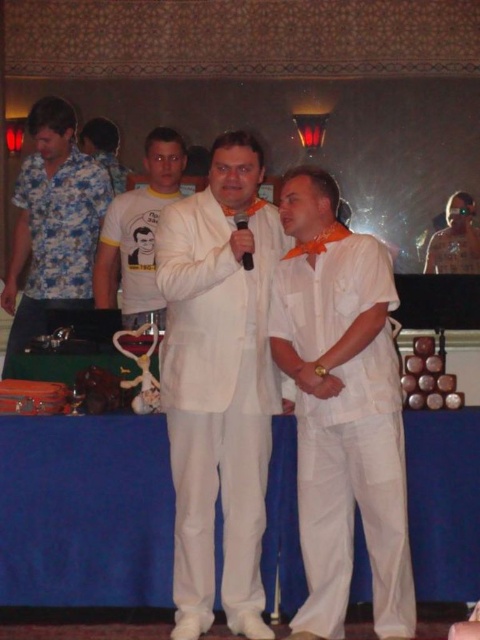
Question: Among these points, which one is nearest to the camera?

Choices:
 (A) (104, 305)
 (B) (233, 218)
 (C) (26, 240)

Answer: (B)

Question: Does white satin shirt at center have a lesser width compared to white cotton t-shirt at center?

Choices:
 (A) yes
 (B) no

Answer: (A)

Question: Can you confirm if white satin shirt at center is positioned above white cotton t-shirt at center?

Choices:
 (A) yes
 (B) no

Answer: (B)

Question: Which point is farther from the camera taking this photo?

Choices:
 (A) (339, 616)
 (B) (210, 336)

Answer: (B)

Question: Is orange fabric tie at center closer to camera compared to black plastic microphone at center?

Choices:
 (A) no
 (B) yes

Answer: (A)

Question: Which point is closer to the camera?

Choices:
 (A) black plastic microphone at center
 (B) white satin shirt at center
 (C) white matte suit at center

Answer: (B)